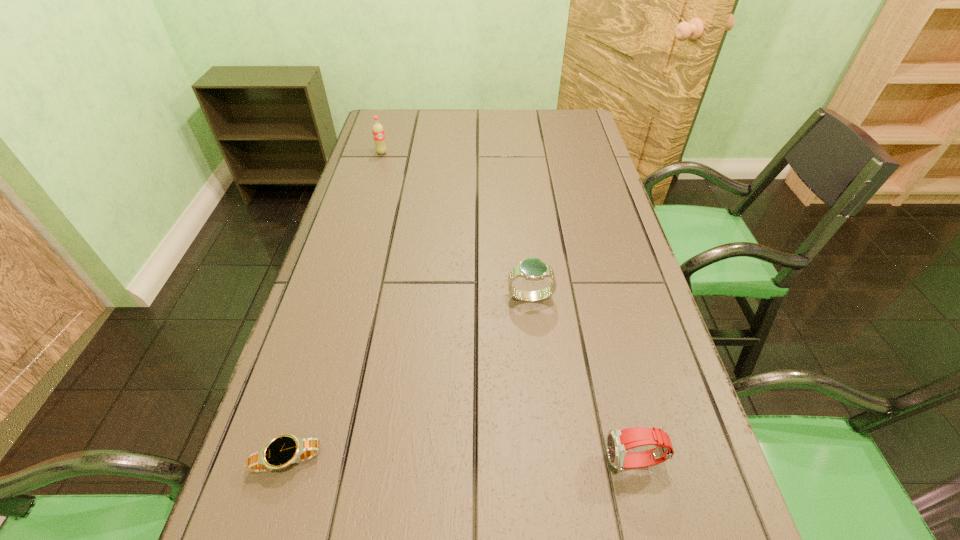
Identify the location of empty space between the soda and the leftmost watch. (335, 306).

What are the coordinates of `vacant space that is in between the second farthest object and the farthest object` in the screenshot? It's located at (456, 225).

Where is `vacant space in between the rightmost object and the tallest object`? This screenshot has width=960, height=540. vacant space in between the rightmost object and the tallest object is located at coordinates (508, 307).

Locate an element on the screen. The height and width of the screenshot is (540, 960). free spot between the shortest watch and the rightmost watch is located at coordinates (461, 461).

At what (x,y) coordinates should I click in order to perform the action: click on vacant area that lies between the rightmost watch and the second watch from right to left. Please return your answer as a coordinate pair (x, y). The image size is (960, 540). Looking at the image, I should click on (582, 380).

You are a GUI agent. You are given a task and a screenshot of the screen. Output one action in this format:
    pyautogui.click(x=<x>, y=<y>)
    Task: Click on the empty location between the third nearest object and the soda
    This screenshot has height=540, width=960.
    Given the screenshot: What is the action you would take?
    pyautogui.click(x=456, y=225)

The width and height of the screenshot is (960, 540). What are the coordinates of `unoccupied area between the rightmost watch and the third object from left to right` in the screenshot? It's located at (582, 380).

I want to click on vacant space that's between the leftmost watch and the third object from left to right, so click(x=409, y=379).

This screenshot has width=960, height=540. What are the coordinates of `empty space between the rightmost watch and the second watch from left to right` in the screenshot? It's located at (582, 380).

In order to click on object that is the second nearest to the leftmost watch in this screenshot , I will do `click(619, 441)`.